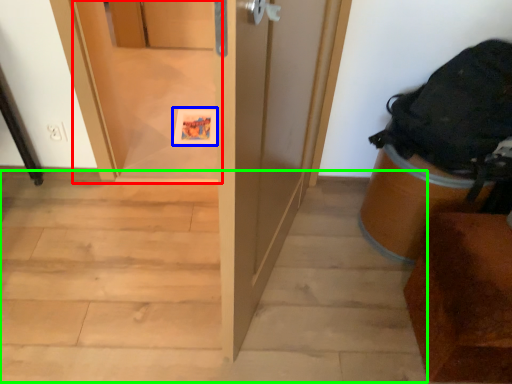
Question: Estimate the real-world distances between objects in this image. Which object is closer to screen door (highlighted by a red box), postcard (highlighted by a blue box) or stairwell (highlighted by a green box)?

Choices:
 (A) postcard
 (B) stairwell

Answer: (A)